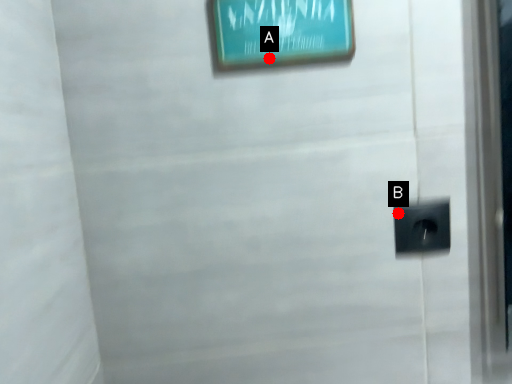
Question: Two points are circled on the image, labeled by A and B beside each circle. Which point is farther to the camera?

Choices:
 (A) A is further
 (B) B is further

Answer: (B)